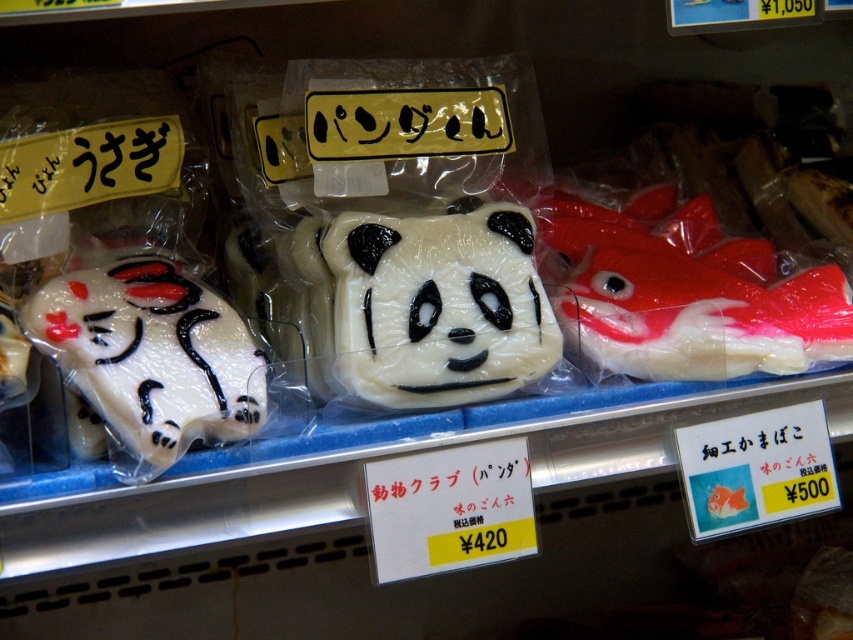
Question: Which object is farther from the camera taking this photo?

Choices:
 (A) white glossy cat at left
 (B) white matte/paper-like panda at center

Answer: (B)

Question: Is white matte/paper-like panda at center closer to camera compared to white glossy cat at left?

Choices:
 (A) no
 (B) yes

Answer: (A)

Question: Is white matte/paper-like panda at center smaller than white glossy cat at left?

Choices:
 (A) yes
 (B) no

Answer: (A)

Question: Is white matte/paper-like panda at center positioned at the back of white glossy cat at left?

Choices:
 (A) no
 (B) yes

Answer: (B)

Question: Which point appears farthest from the camera in this image?

Choices:
 (A) (173, 384)
 (B) (521, 301)

Answer: (B)